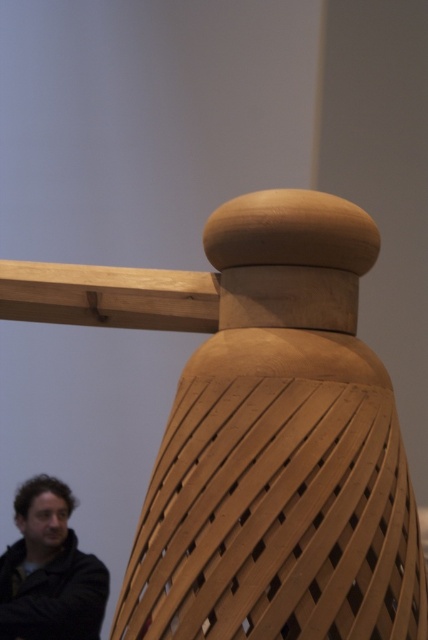
Is natural wood chair at center to the right of dark brown leather jacket at lower left from the viewer's perspective?

Yes, natural wood chair at center is to the right of dark brown leather jacket at lower left.

Is the position of natural wood chair at center more distant than that of dark brown leather jacket at lower left?

No, it is not.

Does point (293, 284) lie behind point (74, 506)?

That is False.

Locate an element on the screen. The width and height of the screenshot is (428, 640). natural wood chair at center is located at coordinates (261, 433).